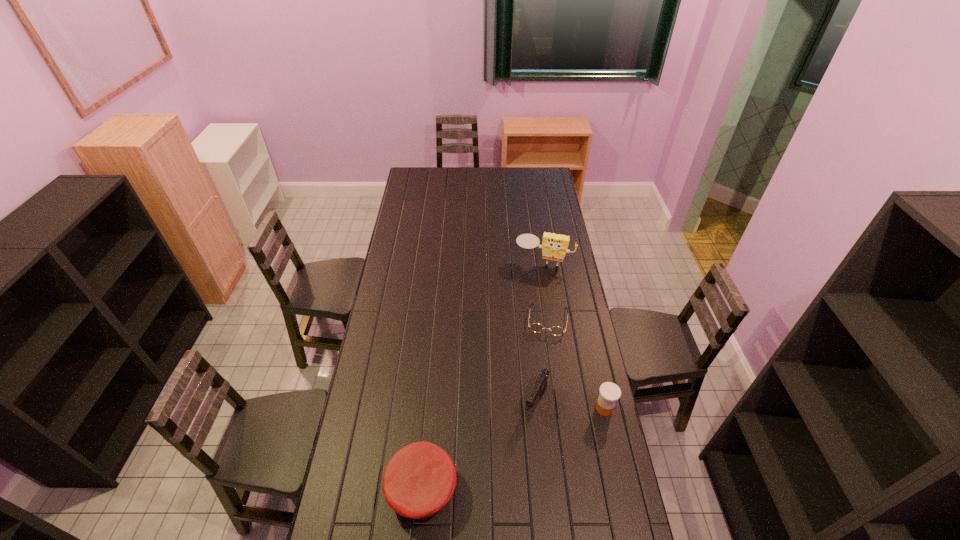
At what (x,y) coordinates should I click in order to perform the action: click on vacant region between the sponge and the medicine. Please return your answer as a coordinate pair (x, y). Looking at the image, I should click on pos(574,335).

Find the location of a particular element. vacant space in between the spectacles and the medicine is located at coordinates (576, 364).

At what (x,y) coordinates should I click in order to perform the action: click on the third closest object relative to the tallest object. Please return your answer as a coordinate pair (x, y). Looking at the image, I should click on (609, 392).

I want to click on the third closest object to the pistol, so pos(420,478).

Find the location of a particular element. free location that satisfies the following two spatial constraints: 1. on the back side of the sponge; 2. on the left side of the spectacles is located at coordinates (540, 262).

The image size is (960, 540). In order to click on free spot that satisfies the following two spatial constraints: 1. on the back side of the shortest object; 2. on the right side of the pistol in this screenshot , I will do `click(527, 319)`.